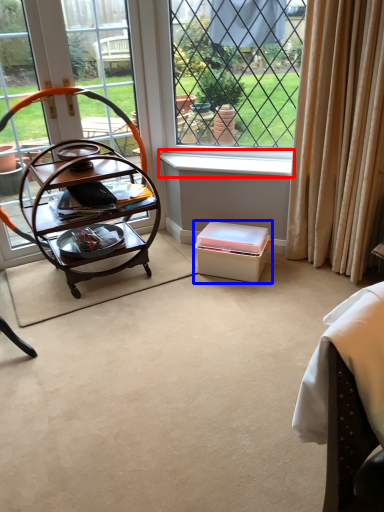
Question: Which point is further to the camera, window sill (highlighted by a red box) or box (highlighted by a blue box)?

Choices:
 (A) window sill
 (B) box

Answer: (A)